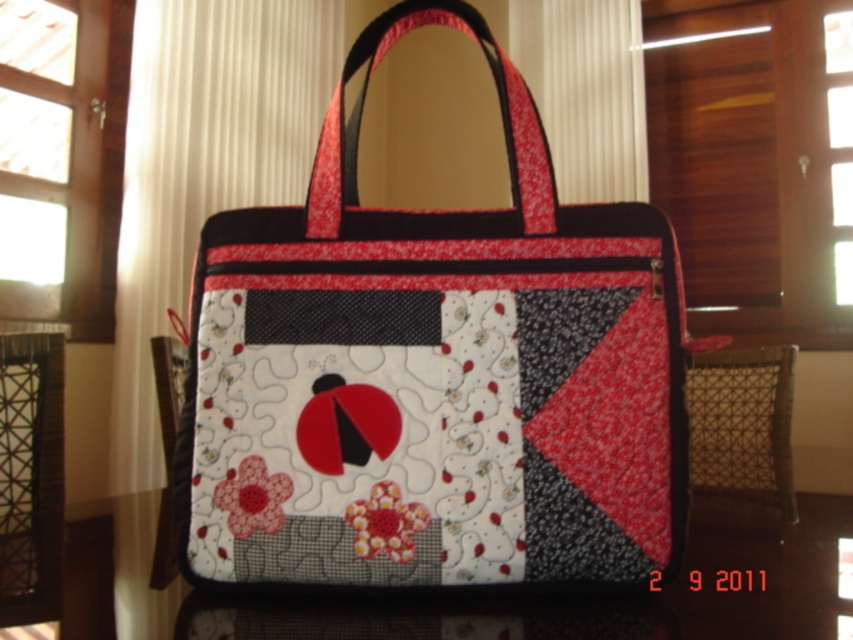
You are organizing a craft fair and have both a quilted fabric bag at center and a quilted fabric at center. Which item takes up more space?

The quilted fabric bag at center has a larger size compared to the quilted fabric at center, so the quilted fabric bag at center takes up more space.

You are organizing a small art exhibit and need to display two items on a table. You have a quilted fabric bag at center and a quilted fabric at center. According to the image, which item is placed on top of the other?

The quilted fabric bag at center is positioned over the quilted fabric at center, meaning the bag is placed on top of the fabric.